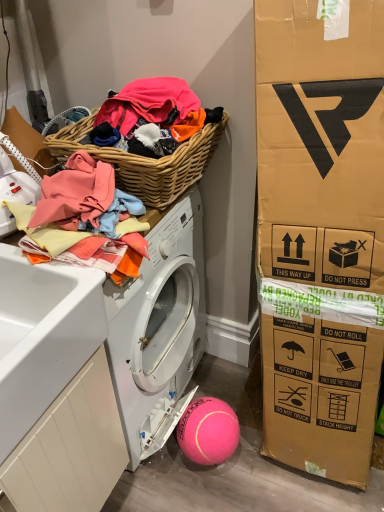
Question: From a real-world perspective, does woven wood picnic basket at upper left stand above white matte washer at left?

Choices:
 (A) no
 (B) yes

Answer: (A)

Question: Is woven wood picnic basket at upper left next to white matte washer at left?

Choices:
 (A) yes
 (B) no

Answer: (B)

Question: Is woven wood picnic basket at upper left aimed at white matte washer at left?

Choices:
 (A) no
 (B) yes

Answer: (A)

Question: From the image's perspective, is woven wood picnic basket at upper left on white matte washer at left?

Choices:
 (A) yes
 (B) no

Answer: (A)

Question: Is woven wood picnic basket at upper left shorter than white matte washer at left?

Choices:
 (A) no
 (B) yes

Answer: (B)

Question: Is white wood drawer at lower left inside the boundaries of woven wood picnic basket at upper left, or outside?

Choices:
 (A) inside
 (B) outside

Answer: (B)

Question: Looking at the image, does white wood drawer at lower left seem bigger or smaller compared to woven wood picnic basket at upper left?

Choices:
 (A) big
 (B) small

Answer: (A)

Question: Considering the positions of point (34, 470) and point (51, 147), is point (34, 470) closer or farther from the camera than point (51, 147)?

Choices:
 (A) closer
 (B) farther

Answer: (A)

Question: Considering the positions of white wood drawer at lower left and woven wood picnic basket at upper left in the image, is white wood drawer at lower left wider or thinner than woven wood picnic basket at upper left?

Choices:
 (A) wide
 (B) thin

Answer: (A)

Question: Visually, is woven wood picnic basket at upper left positioned to the left or to the right of soft cotton towels at upper left?

Choices:
 (A) left
 (B) right

Answer: (B)

Question: Is woven wood picnic basket at upper left wider or thinner than soft cotton towels at upper left?

Choices:
 (A) wide
 (B) thin

Answer: (A)

Question: In terms of height, does woven wood picnic basket at upper left look taller or shorter compared to soft cotton towels at upper left?

Choices:
 (A) tall
 (B) short

Answer: (B)

Question: Considering the positions of point (183, 144) and point (69, 229), is point (183, 144) closer or farther from the camera than point (69, 229)?

Choices:
 (A) farther
 (B) closer

Answer: (A)

Question: Does point (213, 462) appear closer or farther from the camera than point (18, 173)?

Choices:
 (A) farther
 (B) closer

Answer: (A)

Question: From a real-world perspective, is pink rubber ball at lower center above or below white matte washer at left?

Choices:
 (A) above
 (B) below

Answer: (B)